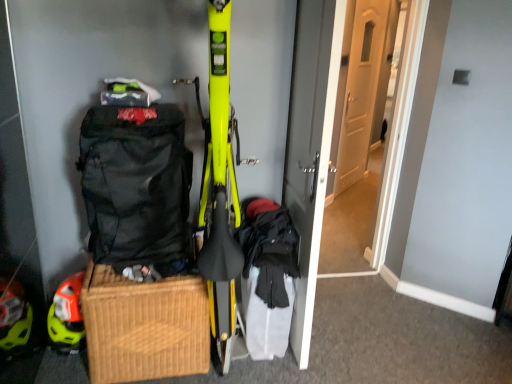
Question: Is orange matte helmet at lower left to the left of white wooden door at center, which appears as the second door when viewed from the left, from the viewer's perspective?

Choices:
 (A) yes
 (B) no

Answer: (A)

Question: Does orange matte helmet at lower left appear on the right side of white wooden door at center, which appears as the second door when viewed from the left?

Choices:
 (A) no
 (B) yes

Answer: (A)

Question: From a real-world perspective, is orange matte helmet at lower left physically below white wooden door at center, which appears as the first door when viewed from the right?

Choices:
 (A) no
 (B) yes

Answer: (B)

Question: Is the depth of orange matte helmet at lower left less than that of white wooden door at center, which appears as the second door when viewed from the left?

Choices:
 (A) yes
 (B) no

Answer: (A)

Question: Is the surface of orange matte helmet at lower left in direct contact with white wooden door at center, which appears as the first door when viewed from the right?

Choices:
 (A) yes
 (B) no

Answer: (B)

Question: Visually, is woven brown picnic basket at lower left positioned to the left or to the right of white wooden door at center, which appears as the first door when viewed from the right?

Choices:
 (A) right
 (B) left

Answer: (B)

Question: From the image's perspective, is woven brown picnic basket at lower left positioned above or below white wooden door at center, which appears as the second door when viewed from the left?

Choices:
 (A) above
 (B) below

Answer: (B)

Question: Is point (179, 317) positioned closer to the camera than point (345, 107)?

Choices:
 (A) closer
 (B) farther

Answer: (A)

Question: From a real-world perspective, relative to white wooden door at center, which appears as the second door when viewed from the left, is woven brown picnic basket at lower left vertically above or below?

Choices:
 (A) below
 (B) above

Answer: (A)

Question: In terms of size, does woven brown picnic basket at lower left appear bigger or smaller than matte gray door at center, which ranks as the 2th door in right-to-left order?

Choices:
 (A) big
 (B) small

Answer: (B)

Question: Is woven brown picnic basket at lower left inside the boundaries of matte gray door at center, which ranks as the 2th door in right-to-left order, or outside?

Choices:
 (A) outside
 (B) inside

Answer: (A)

Question: Based on their positions, is woven brown picnic basket at lower left located to the left or right of matte gray door at center, which ranks as the 2th door in right-to-left order?

Choices:
 (A) left
 (B) right

Answer: (A)

Question: From the image's perspective, is woven brown picnic basket at lower left above or below matte gray door at center, which ranks as the 2th door in right-to-left order?

Choices:
 (A) above
 (B) below

Answer: (B)

Question: Relative to white wooden door at center, which appears as the first door when viewed from the right, is orange matte helmet at lower left in front or behind?

Choices:
 (A) front
 (B) behind

Answer: (A)

Question: Does point click(80, 334) appear closer or farther from the camera than point click(362, 122)?

Choices:
 (A) farther
 (B) closer

Answer: (B)